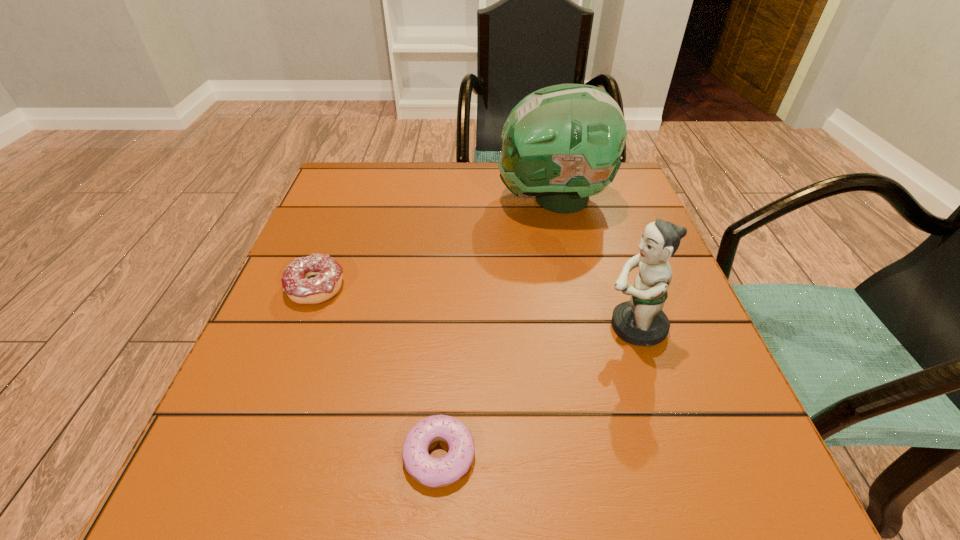
At what (x,y) coordinates should I click in order to perform the action: click on empty space that is in between the shortest object and the figurine. Please return your answer as a coordinate pair (x, y). This screenshot has width=960, height=540. Looking at the image, I should click on (537, 391).

This screenshot has height=540, width=960. Identify the location of vacant space that's between the nearer doughnut and the leftmost object. (377, 371).

Identify the location of unoccupied area between the left doughnut and the farthest object. (434, 244).

Locate an element on the screen. The width and height of the screenshot is (960, 540). vacant point located between the second tallest object and the taller doughnut is located at coordinates (475, 307).

You are a GUI agent. You are given a task and a screenshot of the screen. Output one action in this format:
    pyautogui.click(x=<x>, y=<y>)
    Task: Click on the free space between the second tallest object and the football helmet
    Image resolution: width=960 pixels, height=540 pixels.
    Given the screenshot: What is the action you would take?
    pyautogui.click(x=593, y=263)

Where is `blank region between the figurine and the shortest object`? blank region between the figurine and the shortest object is located at coordinates (537, 391).

Select which object is the third closest to the tallest object. Please provide its 2D coordinates. Your answer should be formatted as a tuple, i.e. [(x, y)], where the tuple contains the x and y coordinates of a point satisfying the conditions above.

[(433, 472)]

Find the location of `object identified as the third closest to the football helmet`. object identified as the third closest to the football helmet is located at coordinates (433, 472).